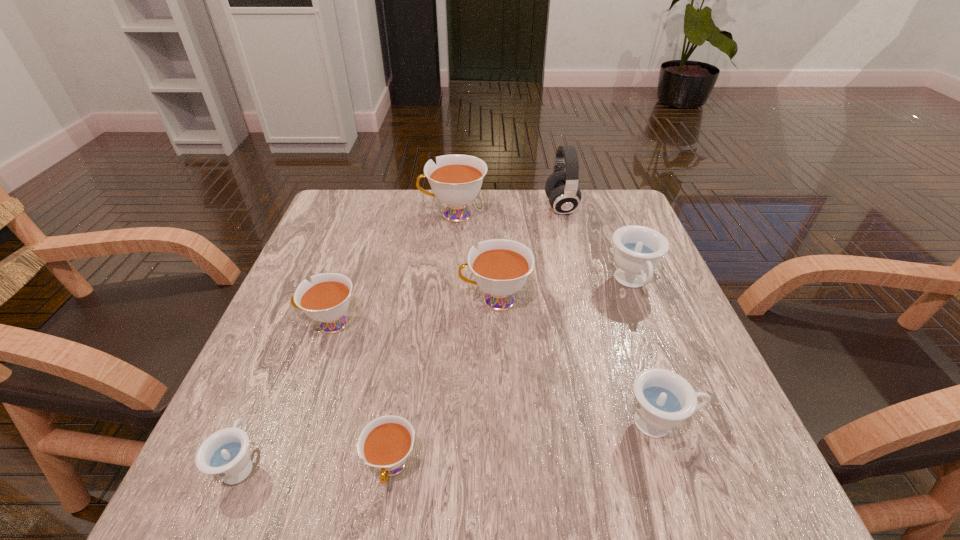
Where is `the tallest object`? The width and height of the screenshot is (960, 540). the tallest object is located at coordinates (561, 187).

Locate an element on the screen. The width and height of the screenshot is (960, 540). the farthest white teacup is located at coordinates (456, 180).

Find the location of a particular element. The height and width of the screenshot is (540, 960). the tallest teacup is located at coordinates (456, 180).

Identify the location of the second biggest white teacup. Image resolution: width=960 pixels, height=540 pixels. (501, 266).

At what (x,y) coordinates should I click in order to perform the action: click on the farthest blue teacup. Please return your answer as a coordinate pair (x, y). This screenshot has width=960, height=540. Looking at the image, I should click on (638, 249).

This screenshot has height=540, width=960. In order to click on the second smallest white teacup in this screenshot , I will do `click(326, 299)`.

Locate an element on the screen. the second smallest blue teacup is located at coordinates (663, 399).

Locate an element on the screen. the smallest white teacup is located at coordinates (385, 443).

This screenshot has height=540, width=960. I want to click on the leftmost blue teacup, so click(225, 455).

Identify the location of vacant space located 0.310m on the ear cups of the tallest object. The width and height of the screenshot is (960, 540). (430, 207).